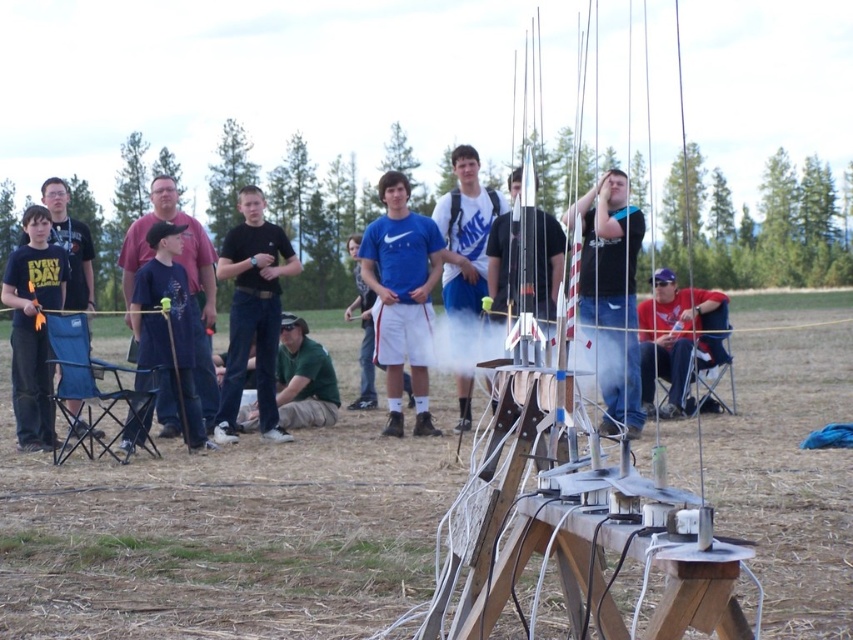
Question: Which of the following is the farthest from the observer?

Choices:
 (A) blue fabric shirt at center
 (B) green fabric shirt at center

Answer: (B)

Question: Is the position of blue fabric shirt at center less distant than that of red cotton shirt at lower right?

Choices:
 (A) no
 (B) yes

Answer: (B)

Question: Which point is farther from the camera taking this photo?

Choices:
 (A) (703, 317)
 (B) (376, 298)

Answer: (A)

Question: Based on their relative distances, which object is farther from the black cotton shirt at center?

Choices:
 (A) dark blue shirt at center
 (B) red cotton shirt at lower right
 (C) blue matte shirt at center
 (D) matte black shirt at center

Answer: (B)

Question: Does black cotton shirt at center appear under red cotton shirt at lower right?

Choices:
 (A) no
 (B) yes

Answer: (A)

Question: Is blue fabric shirt at center to the right of red cotton shirt at lower right from the viewer's perspective?

Choices:
 (A) no
 (B) yes

Answer: (A)